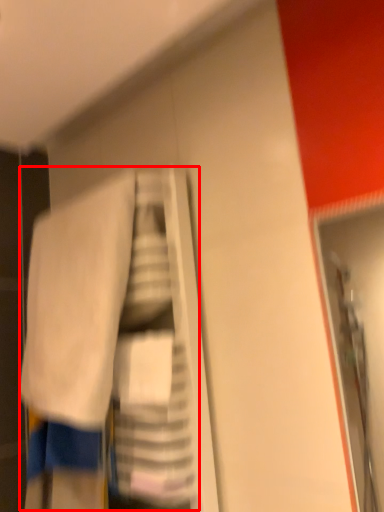
Question: Considering the relative positions of laundry (annotated by the red box) and towel in the image provided, where is laundry (annotated by the red box) located with respect to the staircase?

Choices:
 (A) left
 (B) right

Answer: (B)